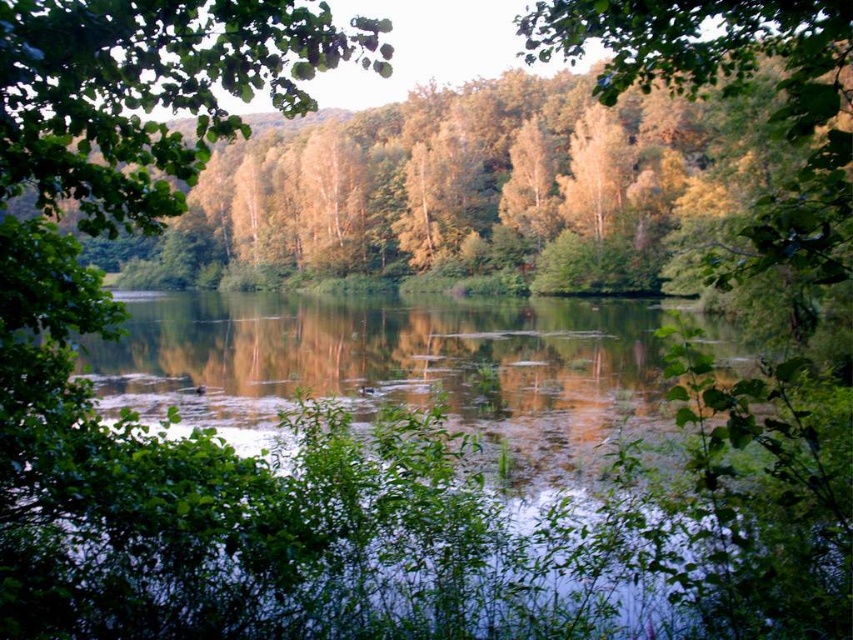
Question: Which object appears farthest from the camera in this image?

Choices:
 (A) green leafy tree at upper left
 (B) green reflective water at center

Answer: (B)

Question: Which point appears farthest from the camera in this image?

Choices:
 (A) (167, 200)
 (B) (548, 376)

Answer: (B)

Question: Does green reflective water at center come behind green leafy tree at upper left?

Choices:
 (A) no
 (B) yes

Answer: (B)

Question: Is green reflective water at center bigger than green leafy tree at upper left?

Choices:
 (A) yes
 (B) no

Answer: (B)

Question: Is the position of green reflective water at center less distant than that of green leafy tree at upper left?

Choices:
 (A) yes
 (B) no

Answer: (B)